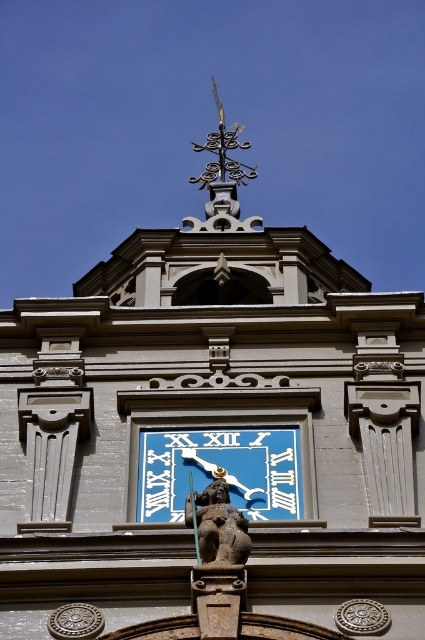
Question: Is blue painted metal clock at center to the left of polished brass weather vane at upper center from the viewer's perspective?

Choices:
 (A) yes
 (B) no

Answer: (B)

Question: Which point is farther to the camera?

Choices:
 (A) (229, 524)
 (B) (220, 131)
 (C) (159, 433)

Answer: (B)

Question: Can you confirm if brown stone lion at center is positioned below polished brass weather vane at upper center?

Choices:
 (A) yes
 (B) no

Answer: (A)

Question: Does blue painted metal clock at center appear under brown stone lion at center?

Choices:
 (A) no
 (B) yes

Answer: (B)

Question: Among these objects, which one is farthest from the camera?

Choices:
 (A) brown stone lion at center
 (B) blue painted metal clock at center

Answer: (B)

Question: Which is nearer to the polished brass weather vane at upper center?

Choices:
 (A) brown stone lion at center
 (B) blue painted metal clock at center

Answer: (A)